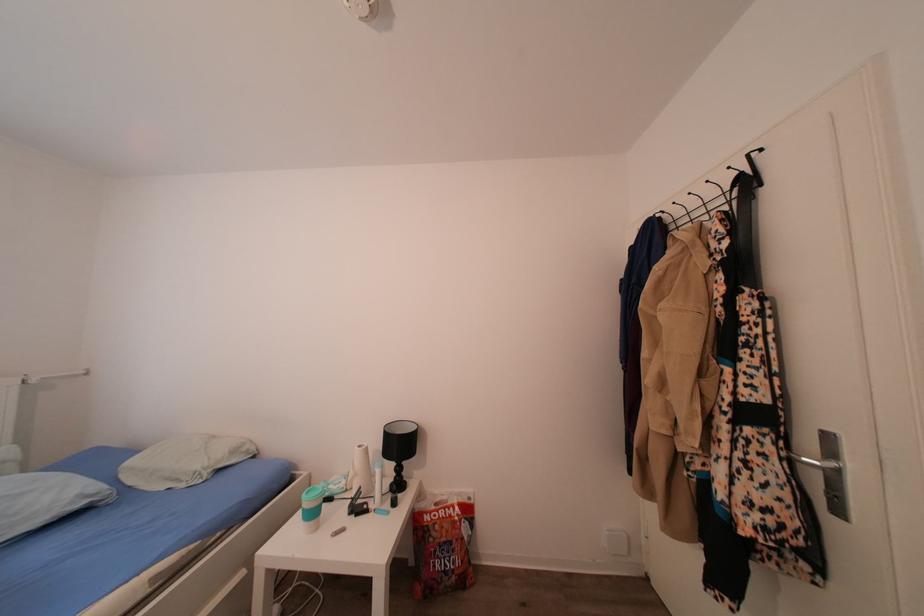
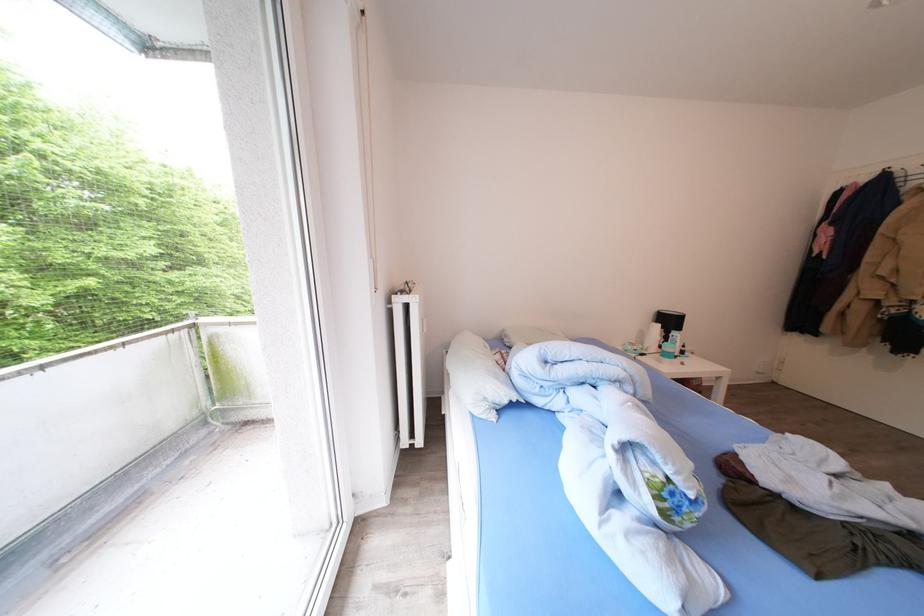
Question: In a continuous first-person perspective shot, in which direction is the camera moving?

Choices:
 (A) Left
 (B) Right
 (C) Forward
 (D) Backward

Answer: (A)